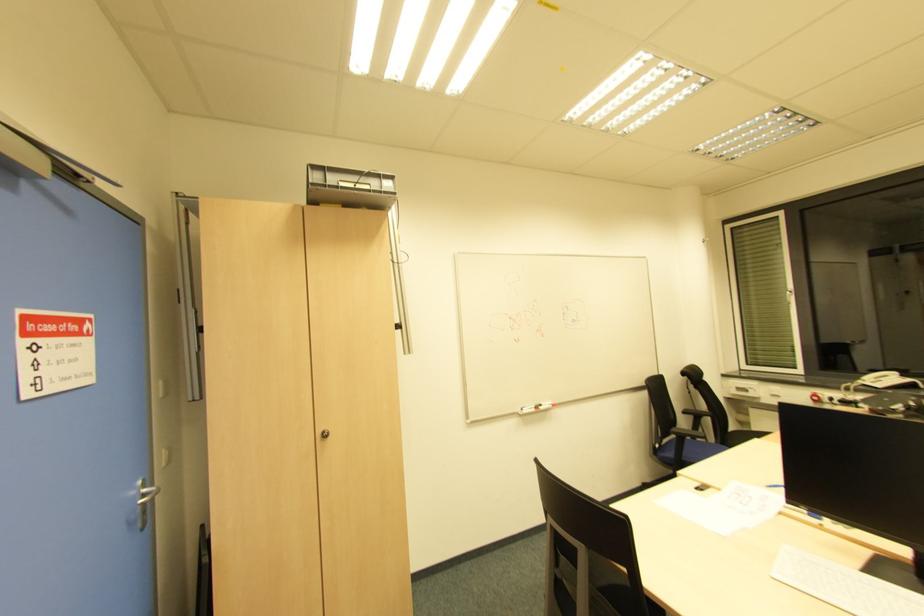
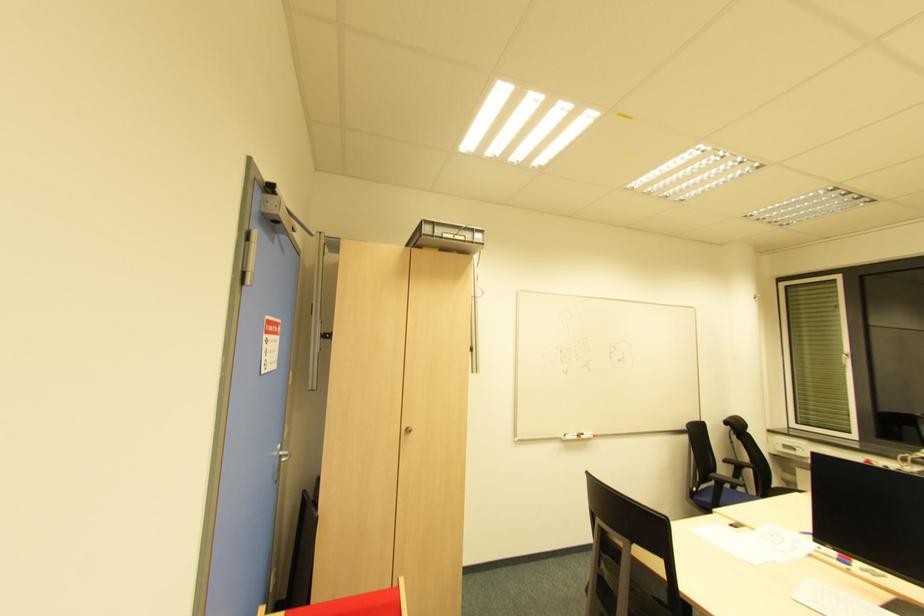
Question: How did the camera likely rotate?

Choices:
 (A) Left
 (B) Right
 (C) Up
 (D) Down

Answer: (A)